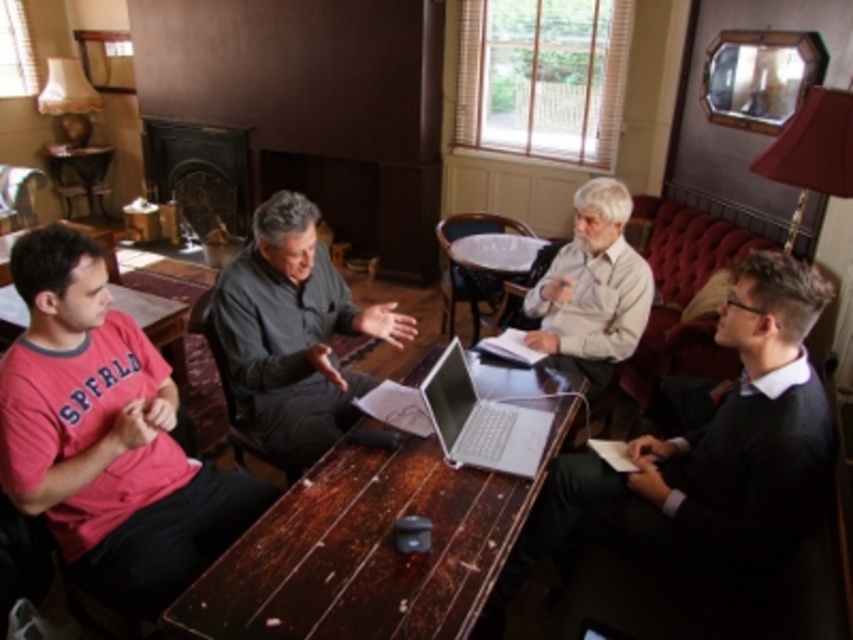
Question: Does wooden table at center have a smaller size compared to dark gray sweater at right?

Choices:
 (A) yes
 (B) no

Answer: (A)

Question: Which object appears closest to the camera in this image?

Choices:
 (A) dark gray sweater at right
 (B) matte pink t-shirt at left
 (C) wooden table at center

Answer: (C)

Question: Among these objects, which one is farthest from the camera?

Choices:
 (A) wooden table at center
 (B) matte pink t-shirt at left

Answer: (B)

Question: Estimate the real-world distances between objects in this image. Which object is closer to the matte pink t-shirt at left?

Choices:
 (A) wooden table at center
 (B) dark gray shirt at center
 (C) dark gray sweater at right
 (D) silver metallic laptop at center

Answer: (A)

Question: Where is wooden table at center located in relation to silver metallic laptop at center in the image?

Choices:
 (A) above
 (B) below

Answer: (B)

Question: Does wooden table at center have a lesser width compared to dark gray sweater at right?

Choices:
 (A) yes
 (B) no

Answer: (B)